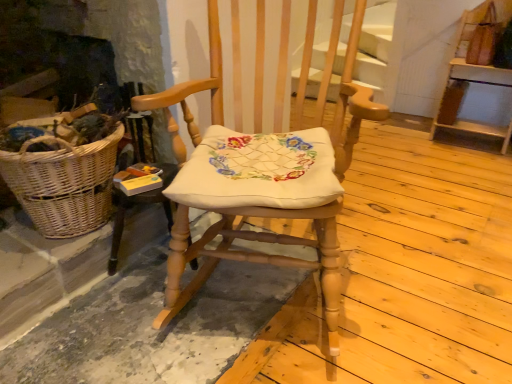
Measure the distance between point (315, 2) and camera.

The distance of point (315, 2) from camera is 1.79 meters.

The width and height of the screenshot is (512, 384). What do you see at coordinates (254, 252) in the screenshot?
I see `wooden rocking chair at center` at bounding box center [254, 252].

The image size is (512, 384). Describe the element at coordinates (63, 183) in the screenshot. I see `woven wicker picnic basket at left` at that location.

This screenshot has height=384, width=512. What do you see at coordinates (465, 95) in the screenshot? I see `wooden shelf at upper right` at bounding box center [465, 95].

Find the location of a particular element. wooden rocking chair at center is located at coordinates (254, 252).

Is point (458, 71) closer or farther from the camera than point (76, 195)?

Point (458, 71) is positioned farther from the camera compared to point (76, 195).

From a real-world perspective, is wooden shelf at upper right positioned above or below woven wicker picnic basket at left?

wooden shelf at upper right is above woven wicker picnic basket at left.

Does wooden shelf at upper right lie behind woven wicker picnic basket at left?

Yes, the depth of wooden shelf at upper right is greater than that of woven wicker picnic basket at left.

Considering the relative sizes of wooden shelf at upper right and wooden rocking chair at center in the image provided, is wooden shelf at upper right thinner than wooden rocking chair at center?

Indeed, wooden shelf at upper right has a lesser width compared to wooden rocking chair at center.

Is wooden shelf at upper right taller than wooden rocking chair at center?

No.

Find the location of a particular element. This screenshot has width=512, height=384. furniture below the wooden rocking chair at center (from a real-world perspective) is located at coordinates (465, 95).

From a real-world perspective, between wooden shelf at upper right and wooden rocking chair at center, who is vertically lower?

From a 3D spatial view, wooden shelf at upper right is below.

From the image's perspective, between woven wicker picnic basket at left and wooden rocking chair at center, which one is located above?

From the image's view, wooden rocking chair at center is above.

Is woven wicker picnic basket at left facing towards wooden rocking chair at center?

Yes, woven wicker picnic basket at left is turned towards wooden rocking chair at center.

Who is shorter, woven wicker picnic basket at left or wooden rocking chair at center?

Standing shorter between the two is woven wicker picnic basket at left.

Locate an element on the screen. Image resolution: width=512 pixels, height=384 pixels. picnic basket below the wooden rocking chair at center (from the image's perspective) is located at coordinates (63, 183).

From a real-world perspective, who is located higher, woven wicker picnic basket at left or wooden shelf at upper right?

In real-world perspective, wooden shelf at upper right is above.

Which of these two, woven wicker picnic basket at left or wooden shelf at upper right, is wider?

With larger width is wooden shelf at upper right.

Do you think woven wicker picnic basket at left is within wooden shelf at upper right, or outside of it?

woven wicker picnic basket at left cannot be found inside wooden shelf at upper right.

Is woven wicker picnic basket at left further to camera compared to wooden shelf at upper right?

No, woven wicker picnic basket at left is closer to the camera.

Between point (342, 179) and point (96, 166), which one is positioned behind?

Point (96, 166)

Identify the location of chair above the woven wicker picnic basket at left (from the image's perspective). (254, 252).

Is wooden rocking chair at center positioned far away from woven wicker picnic basket at left?

They are positioned close to each other.

From the image's perspective, which object appears higher, wooden rocking chair at center or wooden shelf at upper right?

wooden shelf at upper right, from the image's perspective.

From a real-world perspective, who is located higher, wooden rocking chair at center or wooden shelf at upper right?

wooden rocking chair at center, from a real-world perspective.

Considering the relative sizes of wooden rocking chair at center and wooden shelf at upper right in the image provided, is wooden rocking chair at center smaller than wooden shelf at upper right?

No, wooden rocking chair at center is not smaller than wooden shelf at upper right.

Is the surface of wooden rocking chair at center in direct contact with wooden shelf at upper right?

wooden rocking chair at center is not next to wooden shelf at upper right, and they're not touching.

You are a GUI agent. You are given a task and a screenshot of the screen. Output one action in this format:
    pyautogui.click(x=<x>, y=<y>)
    Task: Click on the picnic basket directly beneath the wooden shelf at upper right (from a real-world perspective)
    This screenshot has width=512, height=384.
    Given the screenshot: What is the action you would take?
    pyautogui.click(x=63, y=183)

The width and height of the screenshot is (512, 384). I want to click on furniture located above the wooden rocking chair at center (from the image's perspective), so click(465, 95).

From the picture: Based on their spatial positions, is woven wicker picnic basket at left or wooden rocking chair at center closer to wooden shelf at upper right?

Among the two, wooden rocking chair at center is located nearer to wooden shelf at upper right.

Which object lies further to the anchor point wooden shelf at upper right, wooden rocking chair at center or woven wicker picnic basket at left?

woven wicker picnic basket at left.

Which object lies nearer to the anchor point woven wicker picnic basket at left, wooden rocking chair at center or wooden shelf at upper right?

wooden rocking chair at center is positioned closer to the anchor woven wicker picnic basket at left.

Estimate the real-world distances between objects in this image. Which object is further from wooden rocking chair at center, wooden shelf at upper right or woven wicker picnic basket at left?

Based on the image, wooden shelf at upper right appears to be further to wooden rocking chair at center.

Looking at the image, which one is located further to wooden rocking chair at center, woven wicker picnic basket at left or wooden shelf at upper right?

wooden shelf at upper right.

From the image, which object appears to be farther from woven wicker picnic basket at left, wooden shelf at upper right or wooden rocking chair at center?

The object further to woven wicker picnic basket at left is wooden shelf at upper right.

You are a GUI agent. You are given a task and a screenshot of the screen. Output one action in this format:
    pyautogui.click(x=<x>, y=<y>)
    Task: Click on the chair situated between woven wicker picnic basket at left and wooden shelf at upper right from left to right
    
    Given the screenshot: What is the action you would take?
    pyautogui.click(x=254, y=252)